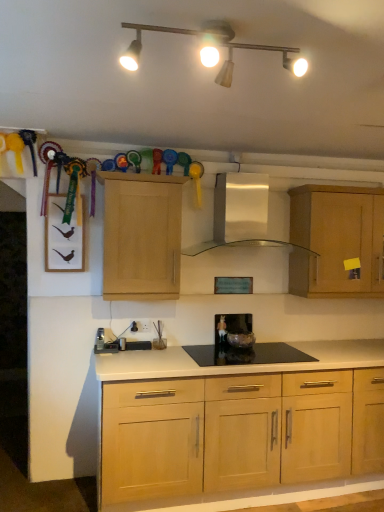
Question: Based on their sizes in the image, would you say white plastic electric outlet at lower center is bigger or smaller than light wood cabinet at upper right, the 1th cabinetry when ordered from back to front?

Choices:
 (A) small
 (B) big

Answer: (A)

Question: Is point (130, 330) positioned closer to the camera than point (360, 204)?

Choices:
 (A) closer
 (B) farther

Answer: (A)

Question: Which object is the farthest from the white plastic electric outlet at lower center?

Choices:
 (A) matte glass bowl at center, which is the second appliance from left to right
 (B) satin silver toaster at lower left, positioned as the second appliance in right-to-left order
 (C) light wood cabinet at upper right, which is counted as the 2th cabinetry, starting from the front
 (D) matte white track lights at upper center
 (E) white glossy range hood at center

Answer: (D)

Question: Estimate the real-world distances between objects in this image. Which object is closer to the white plastic electric outlet at lower center?

Choices:
 (A) satin silver toaster at lower left, the 1th appliance viewed from the left
 (B) white glossy range hood at center
 (C) matte white track lights at upper center
 (D) black glass gas stove at center
 (E) matte glass bowl at center, which is the second appliance from left to right

Answer: (A)